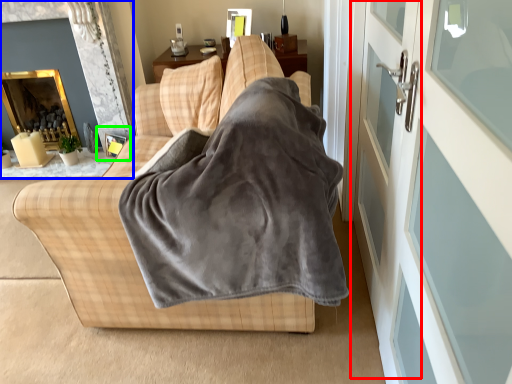
Question: Based on their relative distances, which object is farther from screen door (highlighted by a red box)? Choose from fireplace (highlighted by a blue box) and picture frame (highlighted by a green box).

Choices:
 (A) fireplace
 (B) picture frame

Answer: (A)